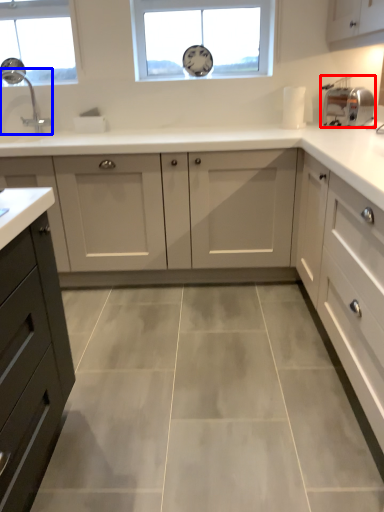
Question: Which of the following is the closest to the observer, appliance (highlighted by a red box) or tap (highlighted by a blue box)?

Choices:
 (A) appliance
 (B) tap

Answer: (A)